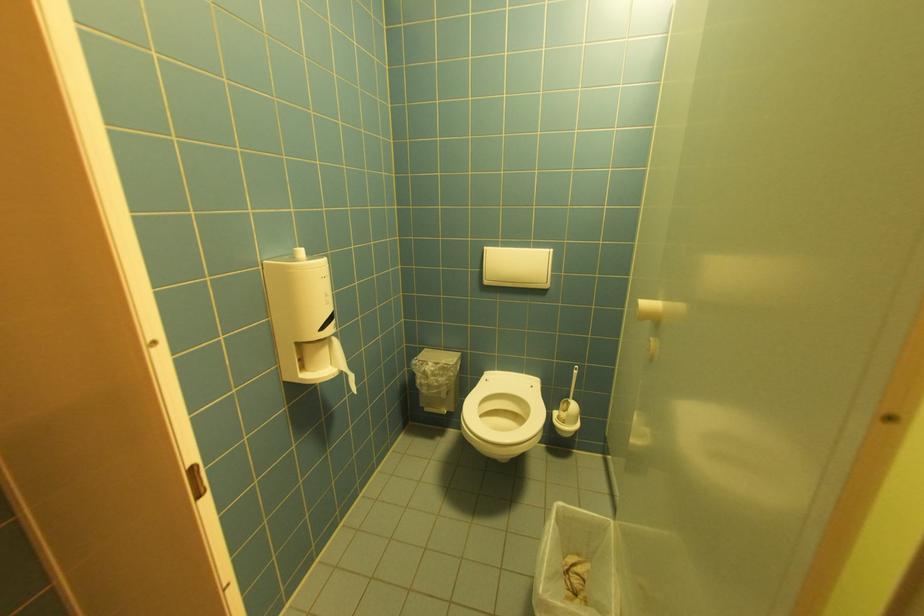
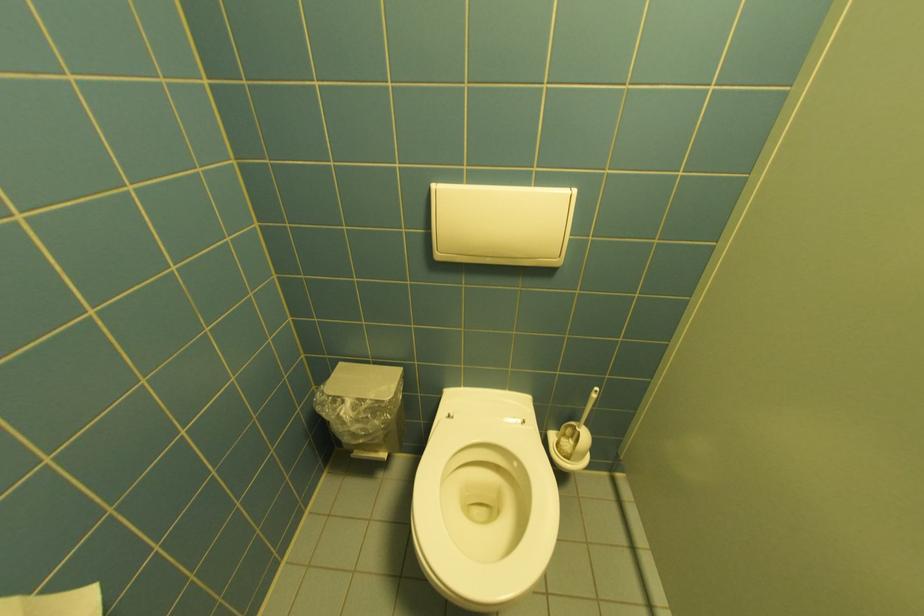
Where in the second image is the point corresponding to pixel 568 422 from the first image?

(570, 455)